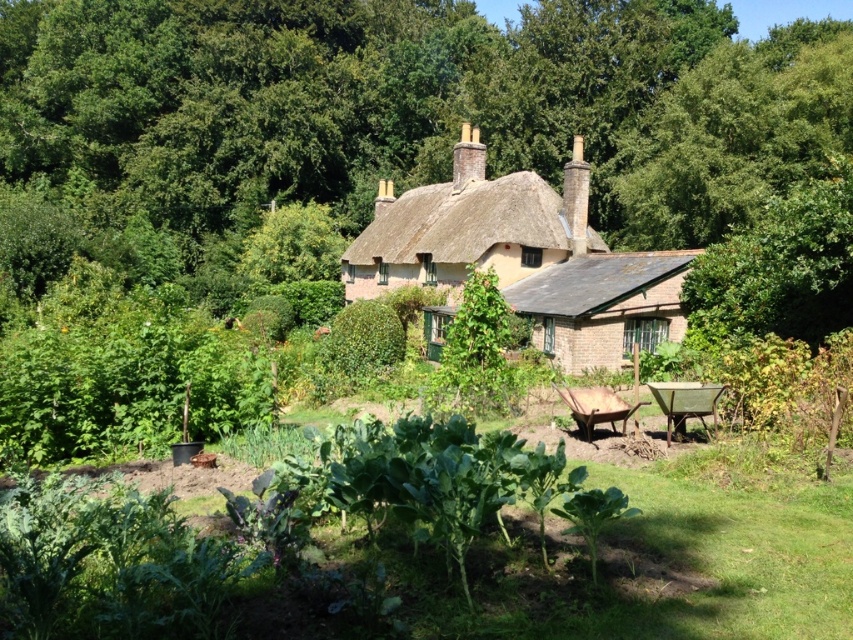
You are a gardener standing at the edge of the garden. You need to water both the green leafy tree at center and the green leafy vegetables at center. Which one is farther from your current position?

The green leafy tree at center is farther from the green leafy vegetables at center, but since you are at the edge of the garden, the distance from you to each might vary. However, based on the given information, the green leafy vegetables at center are closer to the tree than the tree is to them. Wait, this is confusing. Let me check the description again. The description says the tree is 70.34 meters from the vegetables. So if you are at the edge, perhaps the vegetables are closer to you and the tree is 7

You are a gardener standing in the garden of the traditional thatched cottage. You see the green leafy tree at center and the green leafy vegetables at center. Which one is higher up in the scene?

The green leafy tree at center is located above the green leafy vegetables at center, so it is higher up in the scene.

You are standing at the entrance of the cottage and want to take a photo of the green leafy tree at center. If your camera has a maximum focus range of 35 meters, will you be able to capture the tree clearly?

The green leafy tree at center is 36.85 meters away from the camera. Since the camera can only focus up to 35 meters, it won cannot capture the tree clearly within its maximum focus range.